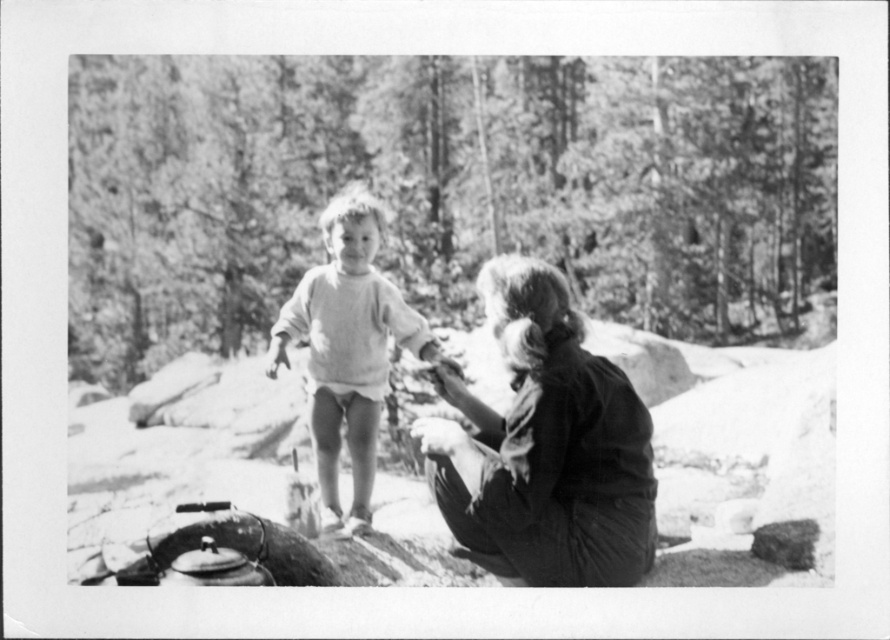
You are a photographer analyzing the composition of this black and white photo. You notice two clothing items worn by the woman in the scene. The dark fabric skirt at center and the white soft sweater at center. Which clothing item is positioned lower on her body?

The dark fabric skirt at center is below the white soft sweater at center, so the dark fabric skirt at center is positioned lower on her body.

You are a photographer trying to capture a candid shot of the dark fabric skirt at center and the white soft sweater at center. If your camera has a focus range of 15 inches, will you be able to capture both objects in focus at the same time?

The dark fabric skirt at center is 15.40 inches away from the white soft sweater at center. Since the distance between them is slightly more than the camera focus range of 15 inches, you might not be able to capture both in focus simultaneously.